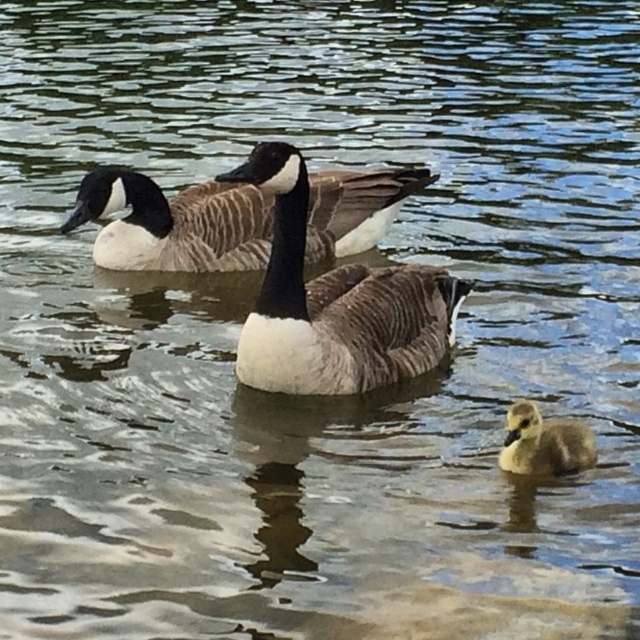
Where is the brown textured goose at center located in the image?

The brown textured goose at center is located at point coordinates of approximately 0.475 on the x axis and 0.523 on the y axis.

You are standing on the lakeshore observing the scene. Which object is closer to you between the brown speckled goose at upper center and the soft gray downy duckling at lower right?

The soft gray downy duckling at lower right is behind the brown speckled goose at upper center, so the brown speckled goose at upper center is closer to you.